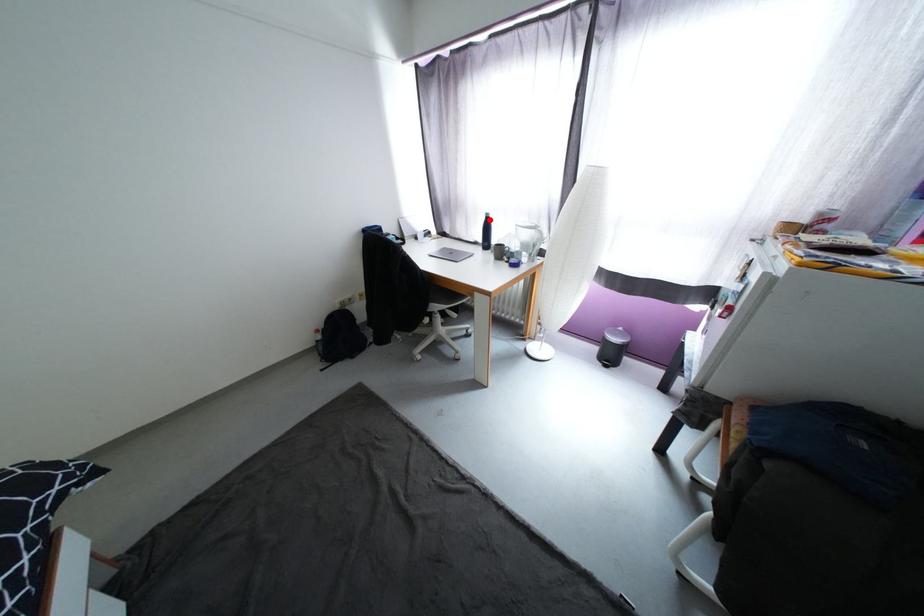
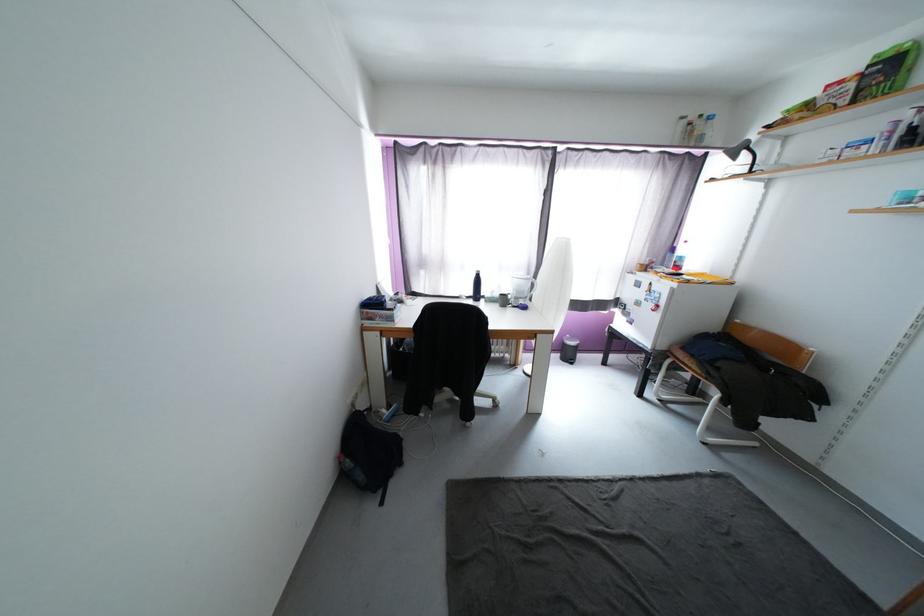
In the second image, find the point that corresponds to the highlighted location in the first image.

(480, 277)